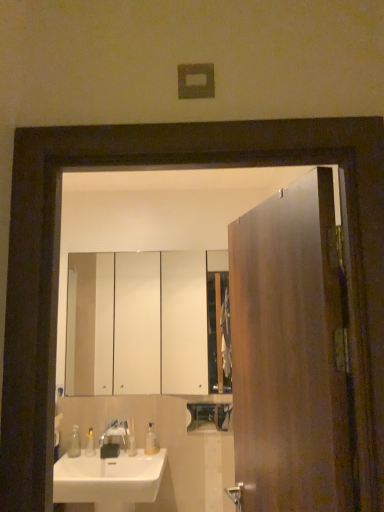
Question: Considering the relative sizes of white glossy cabinet at upper center and translucent plastic soap at lower left, which is counted as the 2th toiletry, starting from the right, in the image provided, is white glossy cabinet at upper center shorter than translucent plastic soap at lower left, which is counted as the 2th toiletry, starting from the right,?

Choices:
 (A) no
 (B) yes

Answer: (A)

Question: Can we say white glossy cabinet at upper center lies outside translucent plastic soap at lower left, which is counted as the 2th toiletry, starting from the right?

Choices:
 (A) no
 (B) yes

Answer: (B)

Question: Can you confirm if white glossy cabinet at upper center is positioned to the left of translucent plastic soap at lower left, which is the first toiletry in left-to-right order?

Choices:
 (A) no
 (B) yes

Answer: (A)

Question: Can you confirm if white glossy cabinet at upper center is wider than translucent plastic soap at lower left, which is counted as the 2th toiletry, starting from the right?

Choices:
 (A) yes
 (B) no

Answer: (B)

Question: From the image's perspective, does white glossy cabinet at upper center appear higher than translucent plastic soap at lower left, which is counted as the 2th toiletry, starting from the right?

Choices:
 (A) yes
 (B) no

Answer: (A)

Question: Does white glossy cabinet at upper center have a larger size compared to translucent plastic soap at lower left, which is the first toiletry in left-to-right order?

Choices:
 (A) yes
 (B) no

Answer: (A)

Question: Does satin nickel faucet at sink left have a smaller size compared to clear plastic soap dispenser at lower left, which is the 1th soap dispenser in left-to-right order?

Choices:
 (A) no
 (B) yes

Answer: (A)

Question: Does satin nickel faucet at sink left have a larger size compared to clear plastic soap dispenser at lower left, the second soap dispenser viewed from the right?

Choices:
 (A) no
 (B) yes

Answer: (B)

Question: Is clear plastic soap dispenser at lower left, which is the 1th soap dispenser in left-to-right order, a part of satin nickel faucet at sink left?

Choices:
 (A) no
 (B) yes

Answer: (A)

Question: Does satin nickel faucet at sink left come behind clear plastic soap dispenser at lower left, the second soap dispenser viewed from the right?

Choices:
 (A) no
 (B) yes

Answer: (A)

Question: Is satin nickel faucet at sink left at the left side of clear plastic soap dispenser at lower left, the second soap dispenser viewed from the right?

Choices:
 (A) yes
 (B) no

Answer: (B)

Question: Is the depth of satin nickel faucet at sink left less than that of clear plastic soap dispenser at lower left, which is the 1th soap dispenser in left-to-right order?

Choices:
 (A) yes
 (B) no

Answer: (A)

Question: Does satin nickel faucet at sink left turn towards translucent plastic soap at center, marked as the first toiletry in a right-to-left arrangement?

Choices:
 (A) yes
 (B) no

Answer: (B)